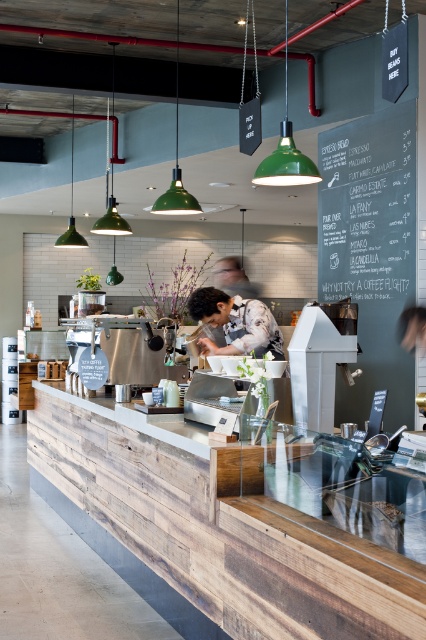
You are a barista working at the coffee shop. You need to reach the black chalkboard menu at upper right to update today special, but you are currently standing at the position of matte black shirt at center. Can you reach the menu without moving your feet?

The black chalkboard menu at upper right is 3.79 feet away from the matte black shirt at center. Since the distance is about 3.79 feet, it is unlikely you can reach it without moving your feet as this distance requires stepping forward.

You are a barista working in the coffee shop and you need to place a coffee cup on the wooden counter at center. However, there is a matte black shirt at center in the way. Can you move the shirt to make space for the cup?

The wooden counter at center is taller than matte black shirt at center, so you can simply place the coffee cup on the wooden counter at center without needing to move the matte black shirt at center since the counter is higher.

You are a customer in the coffee shop and want to place your order. You notice two points on the counter where you can place your items. The first point is at coordinate point (342, 132) and the second is at point (196, 301). Which point is closer to you as you stand at the counter?

Point (342, 132) is closer to you because it is further to the viewer than point (196, 301).